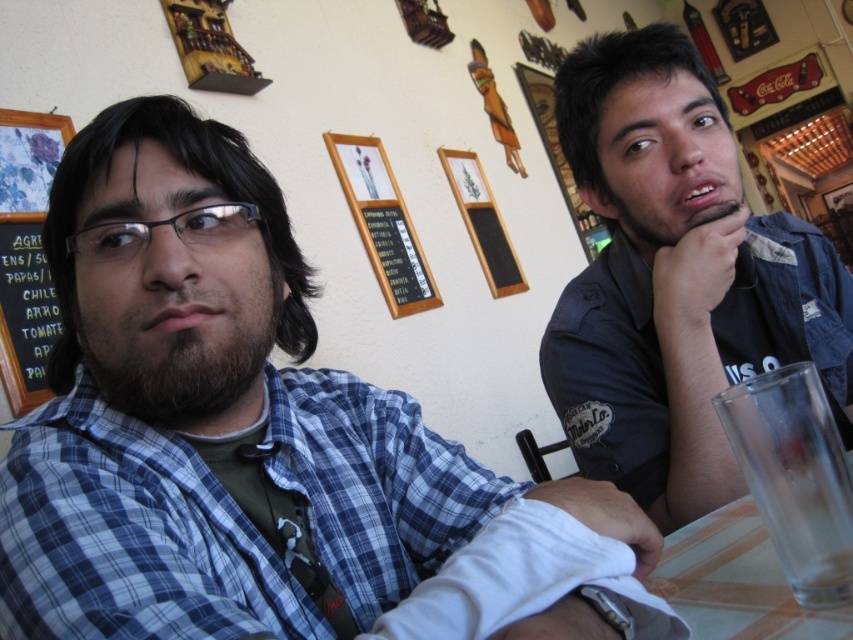
Question: Among these objects, which one is farthest from the camera?

Choices:
 (A) blue plaid shirt at left
 (B) black chalkboard at left
 (C) transparent glass at lower right

Answer: (B)

Question: Does transparent glass at lower right come behind white glossy table at lower right?

Choices:
 (A) no
 (B) yes

Answer: (B)

Question: Which point is closer to the camera?

Choices:
 (A) (796, 627)
 (B) (735, 353)
 (C) (18, 321)
 (D) (838, 579)

Answer: (D)

Question: Does blue plaid shirt at left appear on the left side of white glossy table at lower right?

Choices:
 (A) yes
 (B) no

Answer: (A)

Question: Is transparent glass at lower right bigger than black chalkboard at left?

Choices:
 (A) no
 (B) yes

Answer: (A)

Question: Which point is closer to the camera?

Choices:
 (A) white glossy table at lower right
 (B) dark blue shirt at right

Answer: (A)